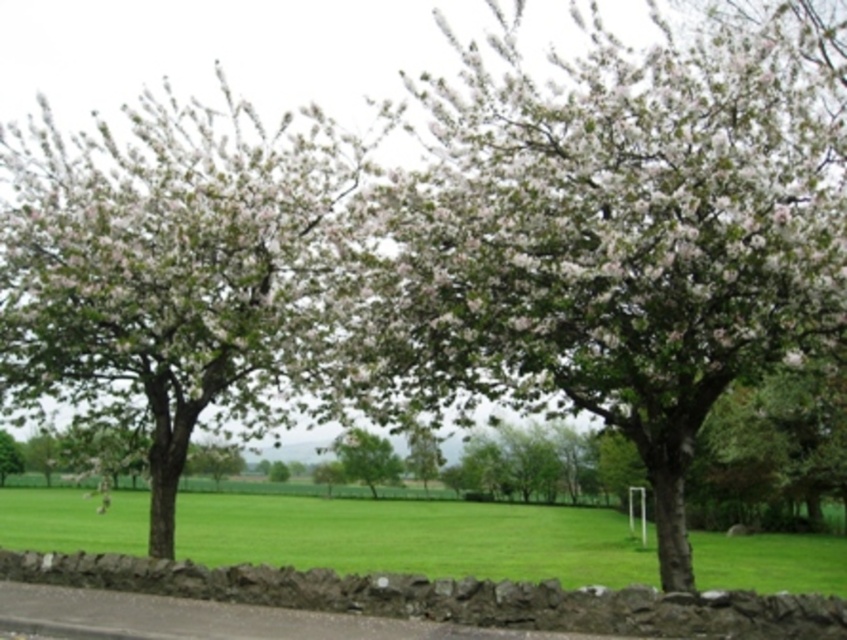
Is point (613, 538) less distant than point (379, 445)?

Yes, point (613, 538) is in front of point (379, 445).

What do you see at coordinates (414, 538) in the screenshot? This screenshot has height=640, width=847. I see `green grass at center` at bounding box center [414, 538].

Is point (289, 561) in front of point (339, 452)?

Yes, point (289, 561) is closer to viewer.

Identify the location of green grass at center. This screenshot has height=640, width=847. (414, 538).

Between point (235, 516) and point (20, 465), which one is positioned in front?

Point (235, 516)

Does green grass at center appear on the left side of white blossoming tree at center?

Incorrect, green grass at center is not on the left side of white blossoming tree at center.

Does point (263, 529) lie in front of point (3, 433)?

Yes, it is.

Where is `green grass at center`? This screenshot has width=847, height=640. green grass at center is located at coordinates (414, 538).

Can you confirm if green leafy tree at center is positioned above white blossoming tree at center?

Correct, green leafy tree at center is located above white blossoming tree at center.

Does green leafy tree at center have a smaller size compared to white blossoming tree at center?

No.

Find the location of `green leafy tree at center`. green leafy tree at center is located at coordinates (367, 458).

Where is `green leafy tree at center`? green leafy tree at center is located at coordinates (367, 458).